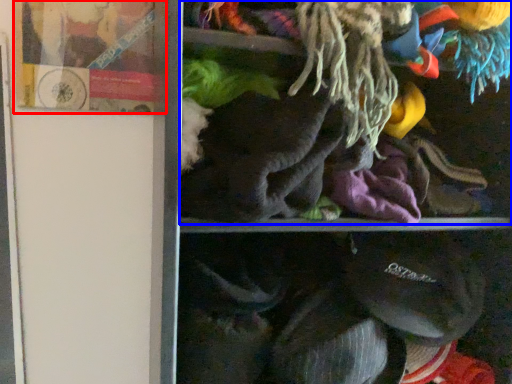
Question: Which object appears farthest to the camera in this image, book (highlighted by a red box) or laundry (highlighted by a blue box)?

Choices:
 (A) book
 (B) laundry

Answer: (A)